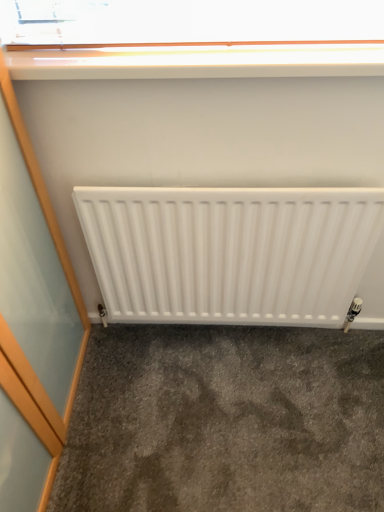
Question: In the image, is white matte radiator at center positioned in front of or behind gray carpet at lower center?

Choices:
 (A) behind
 (B) front

Answer: (B)

Question: Considering the positions of point [314, 284] and point [364, 404], is point [314, 284] closer or farther from the camera than point [364, 404]?

Choices:
 (A) farther
 (B) closer

Answer: (B)

Question: Which of these objects is positioned closest to the gray carpet at lower center?

Choices:
 (A) white glossy window sill at upper center
 (B) white matte radiator at center

Answer: (B)

Question: Which of these objects is positioned closest to the white matte radiator at center?

Choices:
 (A) white glossy window sill at upper center
 (B) gray carpet at lower center

Answer: (B)